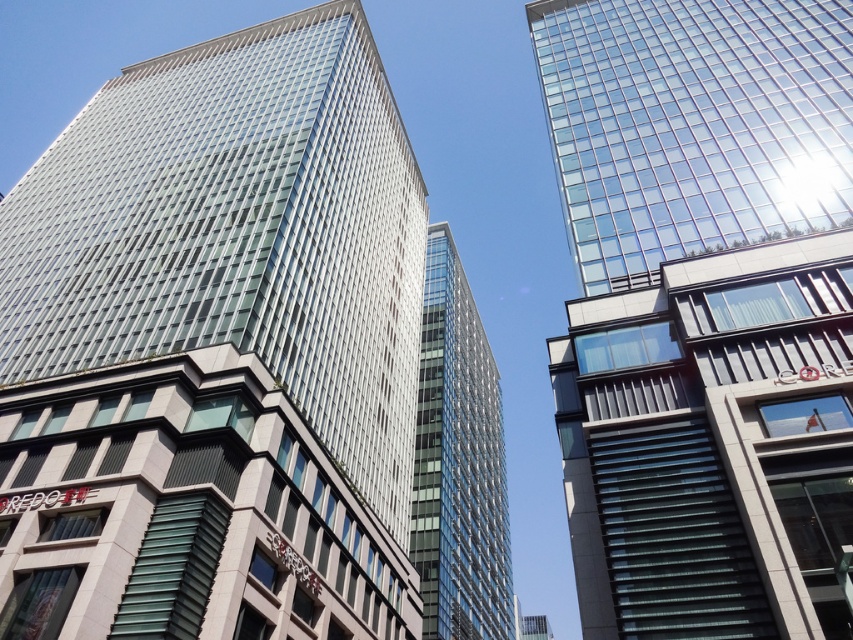
You are standing at the point marked by coordinates point (216, 349) in the image. Looking around, you see the transparent glass building at center. What is the name of the building you are facing?

The point (216, 349) corresponds to the transparent glass building at center, so you are facing the transparent glass building at center.

You are an architect evaluating the feasibility of installing a large billboard between the transparent glass building at center and the transparent glass tower at center. Given their sizes, which building should the billboard be attached to for better visibility?

The transparent glass building at center is larger in size than the transparent glass tower at center, so attaching the billboard to the transparent glass building at center would provide better visibility due to its greater surface area.